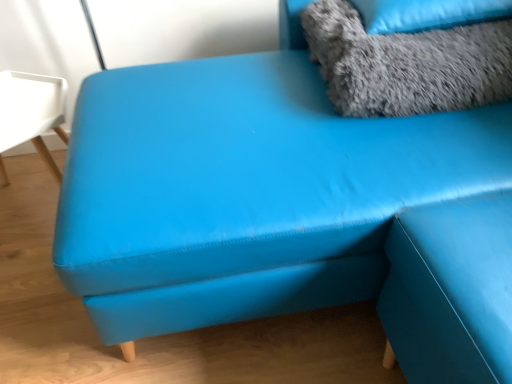
Question: From a real-world perspective, is gray fluffy pillow at upper right under gray fluffy pillow at upper right?

Choices:
 (A) no
 (B) yes

Answer: (B)

Question: Is gray fluffy pillow at upper right positioned beyond the bounds of gray fluffy pillow at upper right?

Choices:
 (A) no
 (B) yes

Answer: (B)

Question: Can you see gray fluffy pillow at upper right touching gray fluffy pillow at upper right?

Choices:
 (A) yes
 (B) no

Answer: (A)

Question: Is gray fluffy pillow at upper right at the right side of gray fluffy pillow at upper right?

Choices:
 (A) no
 (B) yes

Answer: (A)

Question: Is gray fluffy pillow at upper right at the left side of gray fluffy pillow at upper right?

Choices:
 (A) yes
 (B) no

Answer: (A)

Question: Can you confirm if gray fluffy pillow at upper right is wider than gray fluffy pillow at upper right?

Choices:
 (A) no
 (B) yes

Answer: (A)

Question: Is gray fluffy pillow at upper right wider than gray fluffy pillow at upper right?

Choices:
 (A) yes
 (B) no

Answer: (A)

Question: From the image's perspective, is gray fluffy pillow at upper right on gray fluffy pillow at upper right?

Choices:
 (A) no
 (B) yes

Answer: (B)

Question: Is gray fluffy pillow at upper right at the back of gray fluffy pillow at upper right?

Choices:
 (A) yes
 (B) no

Answer: (B)

Question: From the image's perspective, is gray fluffy pillow at upper right below gray fluffy pillow at upper right?

Choices:
 (A) yes
 (B) no

Answer: (B)

Question: Is gray fluffy pillow at upper right next to gray fluffy pillow at upper right and touching it?

Choices:
 (A) no
 (B) yes

Answer: (B)

Question: Considering the relative sizes of gray fluffy pillow at upper right and gray fluffy pillow at upper right in the image provided, is gray fluffy pillow at upper right bigger than gray fluffy pillow at upper right?

Choices:
 (A) no
 (B) yes

Answer: (A)

Question: Is point (316, 26) closer or farther from the camera than point (413, 3)?

Choices:
 (A) farther
 (B) closer

Answer: (A)